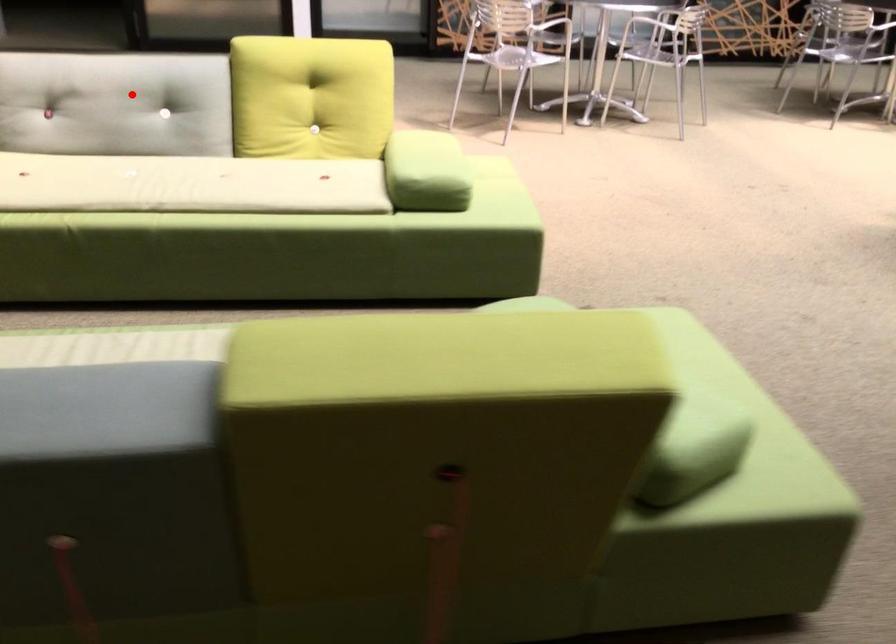
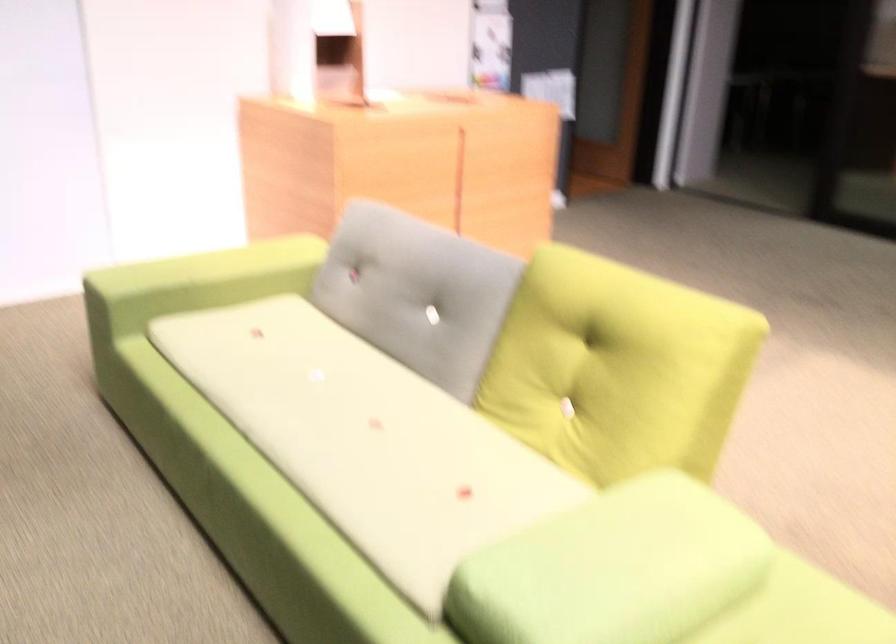
Question: I am providing you with two images of the same scene from different viewpoints. Given a red point in image1, look at the same physical point in image2. Is it:

Choices:
 (A) Closer to the viewpoint
 (B) Farther from the viewpoint

Answer: (A)